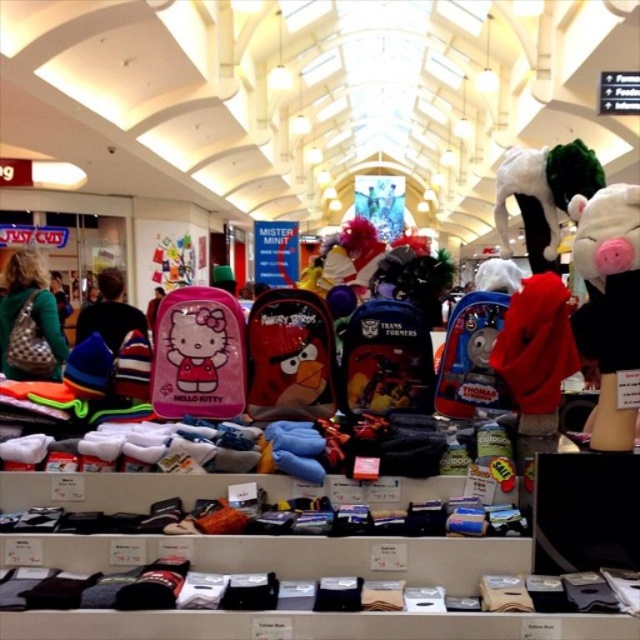
Between white plush pig at center and pink matte backpack at left, which one has less height?

Standing shorter between the two is pink matte backpack at left.

Which is more to the right, white plush pig at center or pink matte backpack at left?

Positioned to the right is white plush pig at center.

Image resolution: width=640 pixels, height=640 pixels. Describe the element at coordinates (609, 307) in the screenshot. I see `white plush pig at center` at that location.

In order to click on white plush pig at center in this screenshot , I will do `click(609, 307)`.

Can you confirm if red fleece sweatshirt at center is shorter than leather handbag at left?

Yes, red fleece sweatshirt at center is shorter than leather handbag at left.

Can you confirm if red fleece sweatshirt at center is wider than leather handbag at left?

No.

Does point (515, 387) lie behind point (1, 330)?

No, it is not.

Locate an element on the screen. red fleece sweatshirt at center is located at coordinates (536, 344).

Does red fleece sweatshirt at center have a lesser height compared to blue fabric thomas the tank engine backpack at center?

No, red fleece sweatshirt at center is not shorter than blue fabric thomas the tank engine backpack at center.

Between red fleece sweatshirt at center and blue fabric thomas the tank engine backpack at center, which one is positioned higher?

Positioned higher is red fleece sweatshirt at center.

Does point (563, 284) lie behind point (461, 340)?

No, (563, 284) is in front of (461, 340).

Locate an element on the screen. red fleece sweatshirt at center is located at coordinates (536, 344).